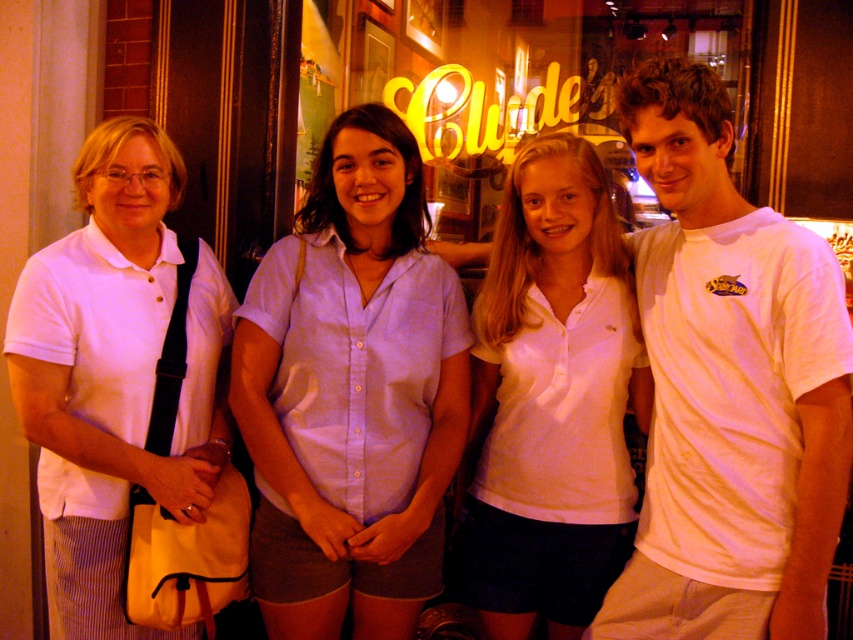
You are trying to decide which white shirt to wear for an evening event. Both the white cotton polo shirt at center and the white matte shirt at left are options. Based on the image, which one is wider?

The white cotton polo shirt at center is wider than the white matte shirt at left.